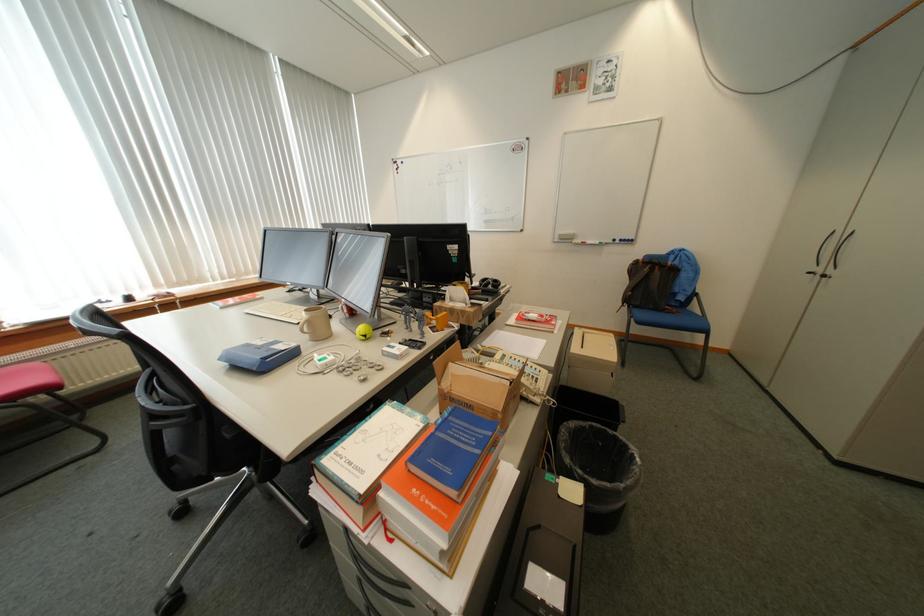
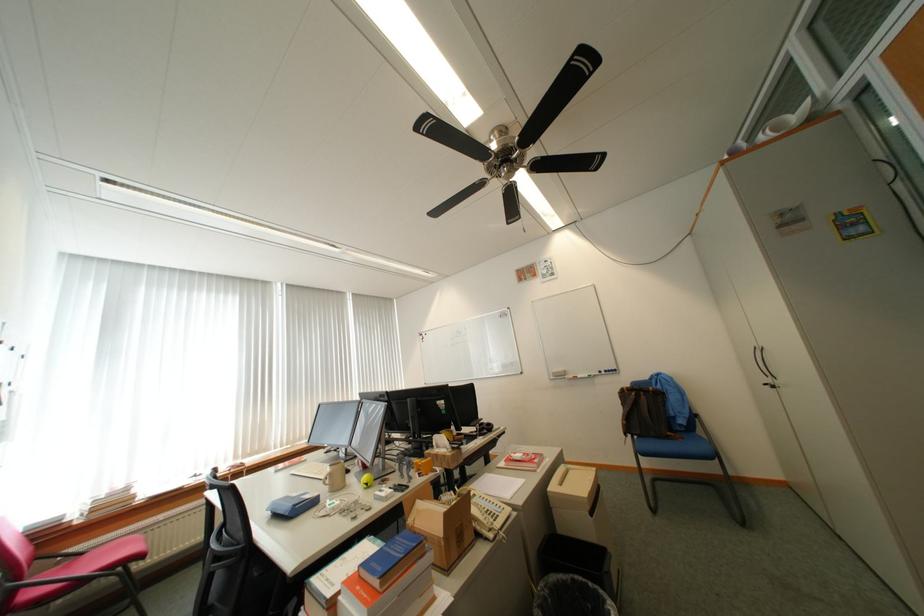
Where in the second image is the point corresponding to [442,463] from the first image?

(383, 565)